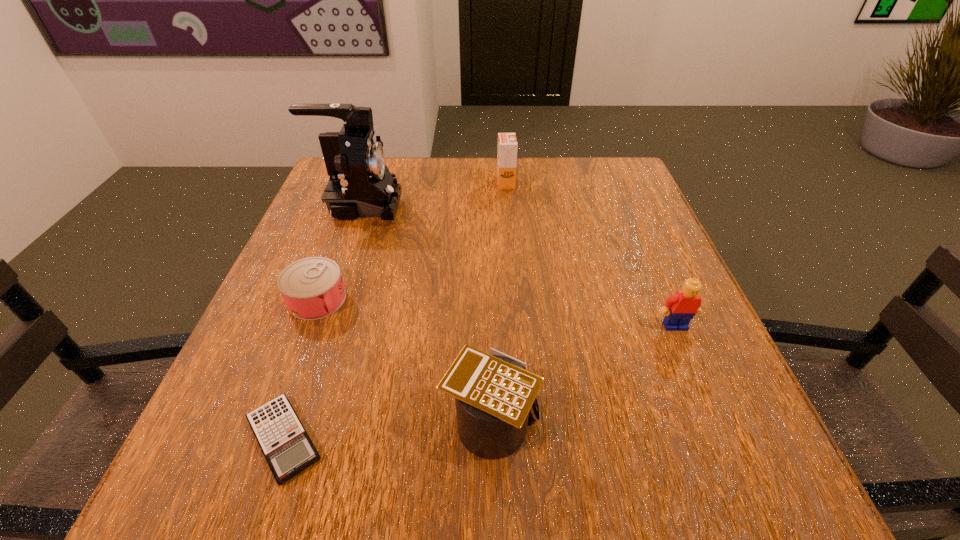
Locate an element on the screen. Image resolution: width=960 pixels, height=540 pixels. camcorder is located at coordinates (360, 185).

Find the location of `orange juice`. orange juice is located at coordinates (507, 143).

Where is `Lego`? Lego is located at coordinates (679, 309).

At what (x,y) coordinates should I click in order to perform the action: click on the right calculator. Please return your answer as a coordinate pair (x, y). The image size is (960, 540). Looking at the image, I should click on (494, 393).

Find the location of a particular element. This screenshot has height=540, width=960. the fifth tallest object is located at coordinates (312, 288).

I want to click on the left calculator, so click(x=288, y=449).

Find the location of `the shortest object`. the shortest object is located at coordinates (288, 449).

In order to click on free region located on the lens mount of the camcorder in this screenshot , I will do pyautogui.click(x=456, y=206).

Find the location of a particular element. vacant space located 0.140m on the left of the orange juice is located at coordinates (443, 183).

At what (x,y) coordinates should I click in order to perform the action: click on vacant point located on the face of the Lego. Please return your answer as a coordinate pair (x, y). Looking at the image, I should click on (723, 439).